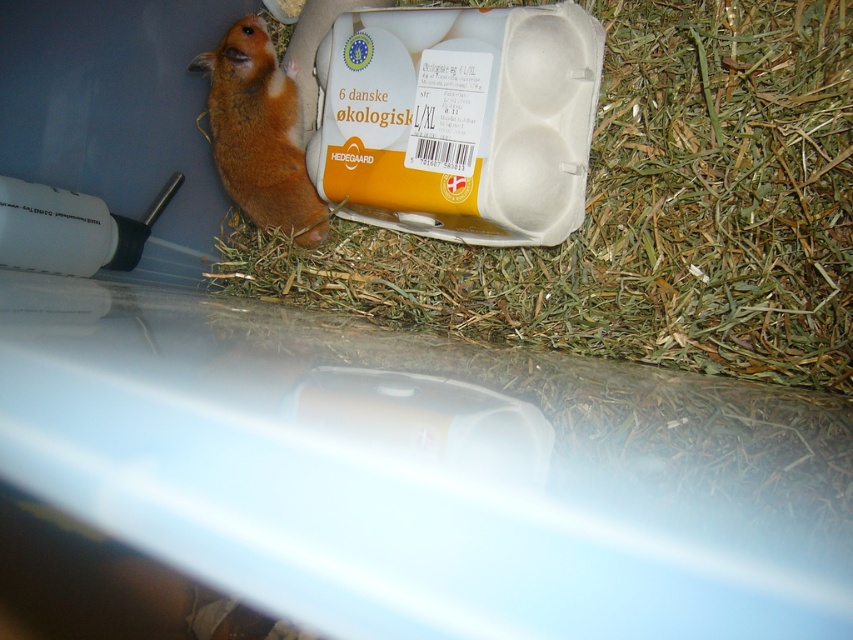
Question: Which of the following is the farthest from the observer?

Choices:
 (A) (231, 152)
 (B) (344, 248)

Answer: (B)

Question: Is green straw at upper center to the left of orange fur hamster at left from the viewer's perspective?

Choices:
 (A) yes
 (B) no

Answer: (B)

Question: Is green straw at upper center below orange fur hamster at left?

Choices:
 (A) no
 (B) yes

Answer: (B)

Question: Is green straw at upper center above orange fur hamster at left?

Choices:
 (A) no
 (B) yes

Answer: (A)